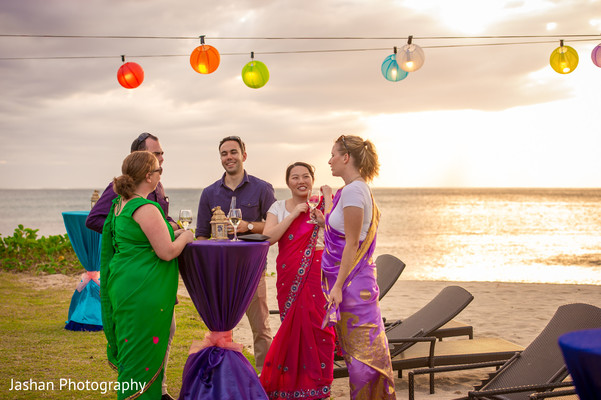
This screenshot has height=400, width=601. I want to click on ball-shaped lights, so click(x=129, y=78), click(x=207, y=63), click(x=398, y=73), click(x=415, y=60), click(x=597, y=57), click(x=561, y=63).